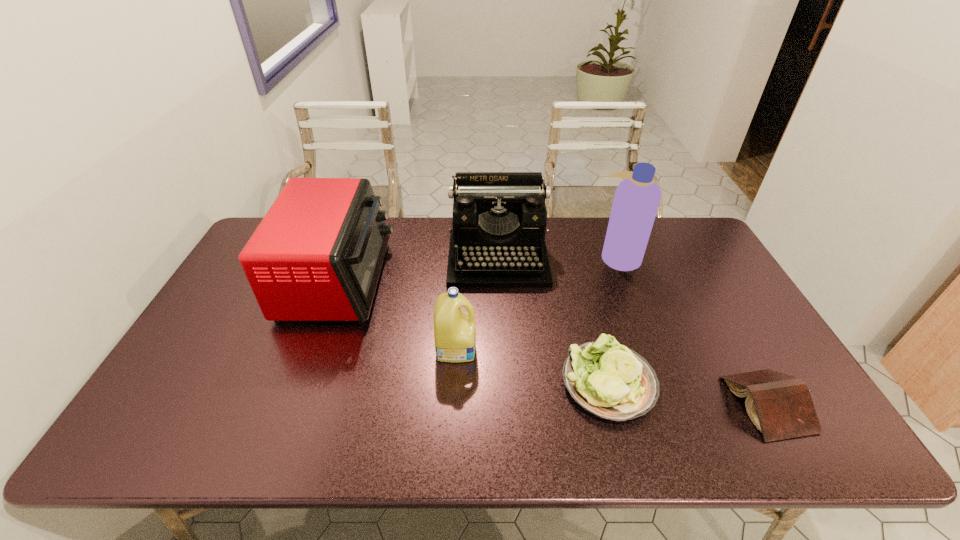
Identify the location of vacant space located on the label of the third shortest object. The image size is (960, 540). (517, 347).

You are a GUI agent. You are given a task and a screenshot of the screen. Output one action in this format:
    pyautogui.click(x=<x>, y=<y>)
    Task: Click on the vacant area situated 0.230m on the right of the fifth tallest object
    Image resolution: width=960 pixels, height=540 pixels.
    Given the screenshot: What is the action you would take?
    pyautogui.click(x=748, y=383)

Image resolution: width=960 pixels, height=540 pixels. What are the coordinates of `vacant position located 0.100m on the left of the shortest object` in the screenshot? It's located at (689, 404).

Where is `shampoo located in the far edge section of the desktop`? The width and height of the screenshot is (960, 540). shampoo located in the far edge section of the desktop is located at coordinates (636, 201).

Locate an element on the screen. typewriter situated at the far edge is located at coordinates (499, 220).

The image size is (960, 540). Identify the location of toaster oven situated at the far edge. (317, 254).

Find the location of a particular element. The width and height of the screenshot is (960, 540). lettuce situated at the near edge is located at coordinates (x=607, y=379).

Where is `book that is at the near edge`? This screenshot has height=540, width=960. book that is at the near edge is located at coordinates (780, 406).

Find the location of a particular element. This screenshot has width=960, height=540. object that is at the right edge is located at coordinates (780, 406).

Identify the location of object that is at the near right corner. Image resolution: width=960 pixels, height=540 pixels. (780, 406).